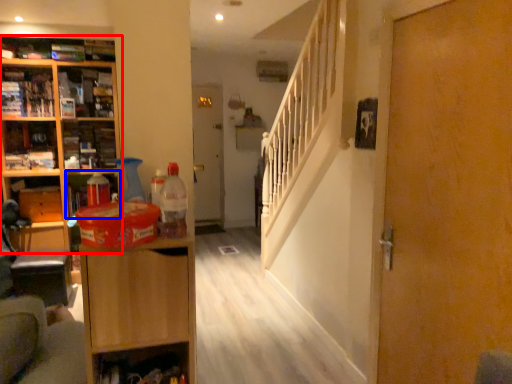
Question: Which object appears closest to the camera in this image, cabinetry (highlighted by a red box) or cabinet (highlighted by a blue box)?

Choices:
 (A) cabinetry
 (B) cabinet

Answer: (B)